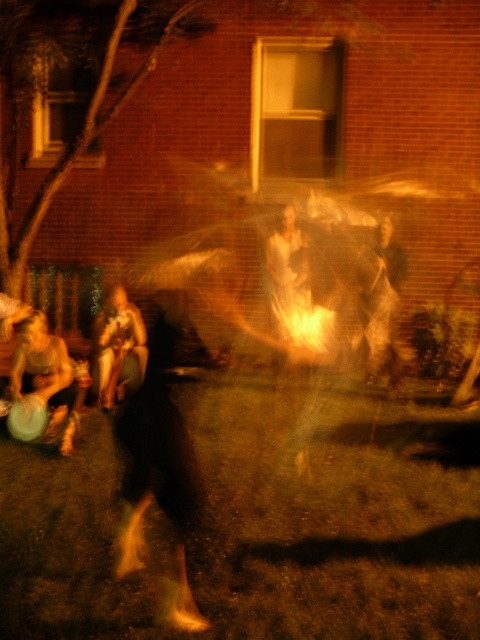
Who is lower down, matte black frisbee at lower left or dark fabric bag at center?

Positioned lower is matte black frisbee at lower left.

At what (x,y) coordinates should I click in order to perform the action: click on matte black frisbee at lower left. Please return your answer as a coordinate pair (x, y). This screenshot has height=640, width=480. Looking at the image, I should click on (46, 378).

Who is higher up, matte black frisbee at lower left or smooth beige sweater at lower left?

A: smooth beige sweater at lower left

Does matte black frisbee at lower left have a larger size compared to smooth beige sweater at lower left?

Indeed, matte black frisbee at lower left has a larger size compared to smooth beige sweater at lower left.

This screenshot has width=480, height=640. What do you see at coordinates (46, 378) in the screenshot? I see `matte black frisbee at lower left` at bounding box center [46, 378].

Locate an element on the screen. The image size is (480, 640). matte black frisbee at lower left is located at coordinates (46, 378).

Who is more distant from viewer, [375,285] or [133,324]?

Point [375,285]

Is point (391, 234) less distant than point (113, 364)?

No.

What are the coordinates of `dark fabric bag at center` in the screenshot? It's located at (381, 301).